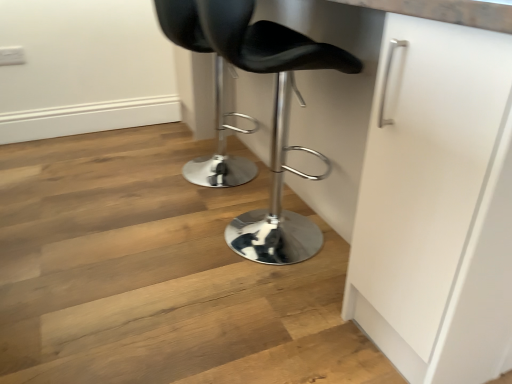
Locate an element on the screen. Image resolution: width=512 pixels, height=384 pixels. free space to the left of black leather stool at center, the first chair when ordered from back to front is located at coordinates (123, 171).